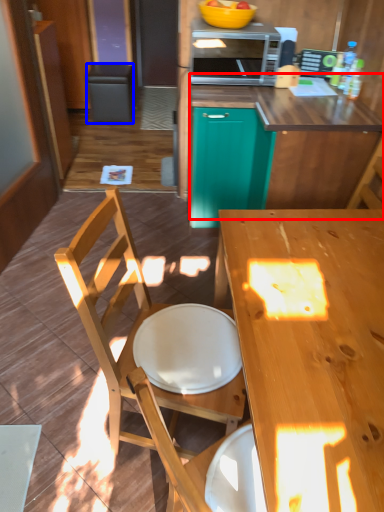
Question: Which of the following is the farthest to the observer, counter (highlighted by a red box) or trash bin/can (highlighted by a blue box)?

Choices:
 (A) counter
 (B) trash bin/can

Answer: (B)